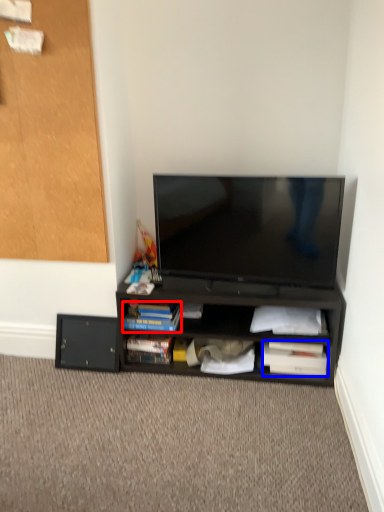
Question: Which object is further to the camera taking this photo, paperback book (highlighted by a red box) or paperback book (highlighted by a blue box)?

Choices:
 (A) paperback book
 (B) paperback book

Answer: (B)